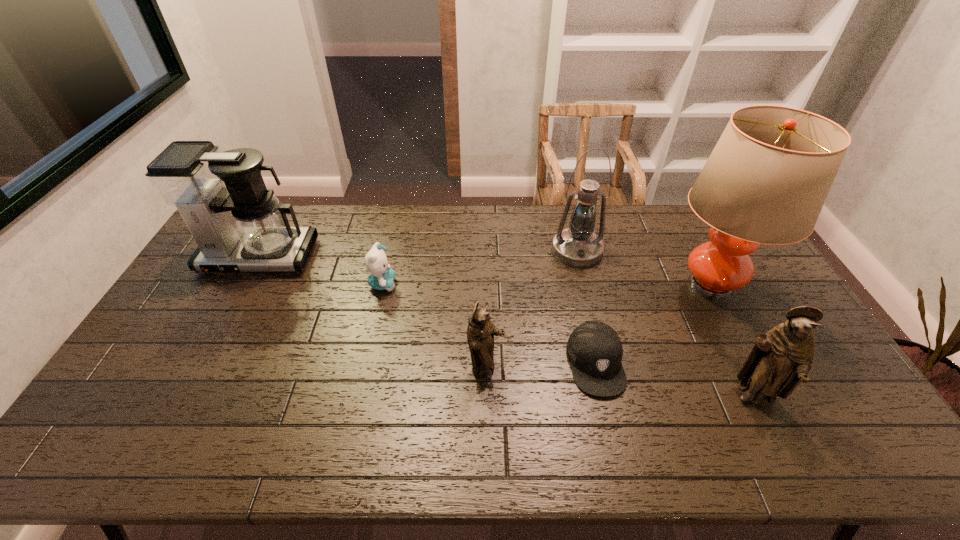
Please show where to add a figurine on the left while keeping spacing even. Please provide its 2D coordinates. Your answer should be formatted as a tuple, i.e. [(x, y)], where the tuple contains the x and y coordinates of a point satisfying the conditions above.

[(245, 343)]